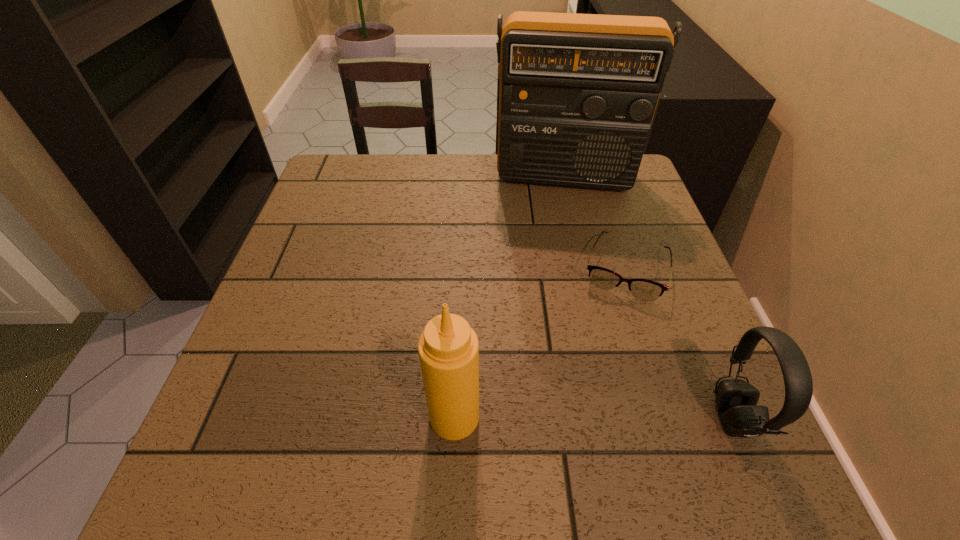
Identify the location of free space on the desktop that is between the leftmost object and the second shortest object and is positioned on the face of the shortest object. Image resolution: width=960 pixels, height=540 pixels. (587, 417).

Find the location of a particular element. This screenshot has width=960, height=540. vacant spot on the desktop that is between the second tallest object and the headset and is positioned on the front-facing side of the radio receiver is located at coordinates (560, 417).